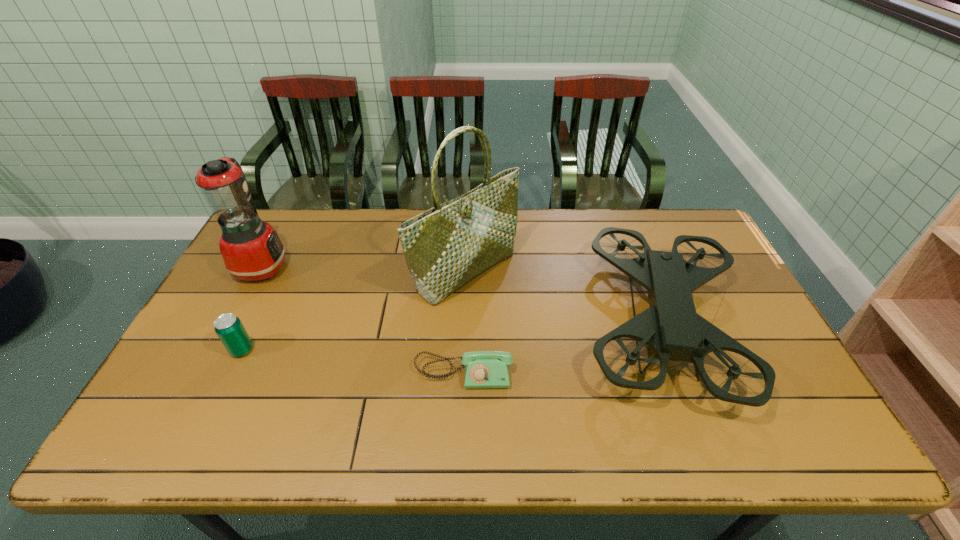
The image size is (960, 540). Find the location of `object positioned at the near right corner`. object positioned at the near right corner is located at coordinates (670, 326).

I want to click on vacant space at the far edge of the desktop, so click(606, 249).

Identify the location of vacant position at the near edge of the desktop. (577, 447).

The image size is (960, 540). I want to click on vacant space at the right edge of the desktop, so click(x=727, y=320).

Where is `vacant region between the shortest object and the second shortest object`? vacant region between the shortest object and the second shortest object is located at coordinates (353, 361).

The height and width of the screenshot is (540, 960). I want to click on free space between the beer can and the tallest object, so click(354, 310).

Locate an element on the screen. The image size is (960, 540). free space between the third shortest object and the second tallest object is located at coordinates pos(462,294).

You are a GUI agent. You are given a task and a screenshot of the screen. Output one action in this format:
    pyautogui.click(x=<x>, y=<y>)
    Task: Click on the empty location between the telephone and the tallest object
    This screenshot has height=540, width=960.
    Given the screenshot: What is the action you would take?
    pyautogui.click(x=465, y=322)

Image resolution: width=960 pixels, height=540 pixels. I want to click on unoccupied position between the tallest object and the shortest object, so click(465, 322).

Identify the location of free space between the rightmost object and the second tallest object. This screenshot has width=960, height=540. (462, 294).